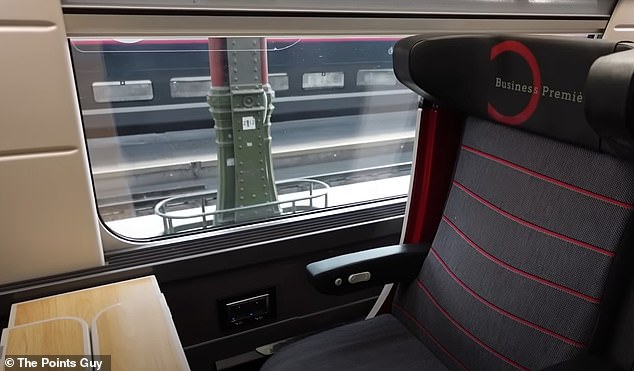
This screenshot has width=634, height=371. Find the location of `seat`. seat is located at coordinates (517, 219).